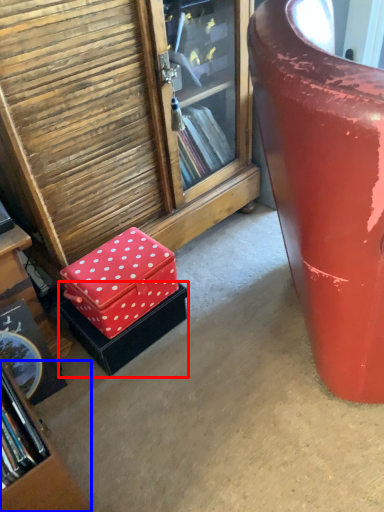
Question: Which object appears farthest to the camera in this image, box (highlighted by a red box) or bookcase (highlighted by a blue box)?

Choices:
 (A) box
 (B) bookcase

Answer: (A)